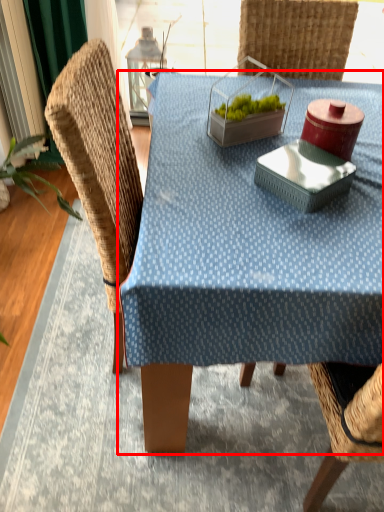
Question: From the image's perspective, considering the relative positions of table (annotated by the red box) and swivel chair in the image provided, where is table (annotated by the red box) located with respect to the staircase?

Choices:
 (A) below
 (B) above

Answer: (A)